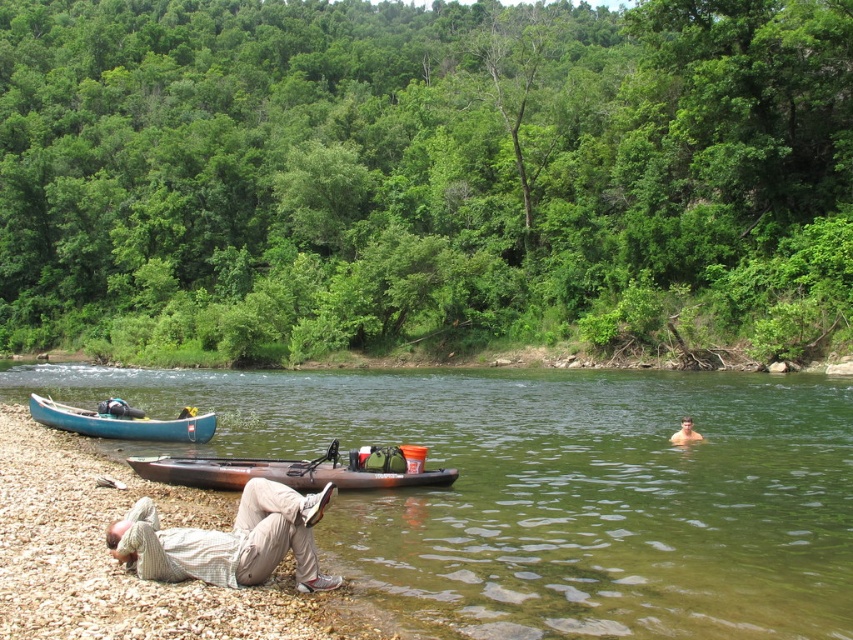
You are a hiker who just arrived at the riverside and see the smooth pebbles at lower left and the light brown cotton pants at lower left. If you want to pick up the pebbles without moving the pants, which direction should you move your hand relative to the pants?

The smooth pebbles at lower left are to the left of the light brown cotton pants at lower left. So, you should move your hand to the left side of the pants to pick up the pebbles without disturbing them.

You are standing at the edge of the river and want to cross to the opposite bank. The green water at center is where the current is calmest. If you aim for the coordinates given by the point, will you reach the middle of the river?

The green water at center is located at point (553, 490), so aiming for those coordinates will direct you to the middle of the river where the current is calmest.

In the scene shown: You are standing at the point closest to the river in this riverside scene. Which of the two points, point (202,408) or point (140,436), is farther away from you?

Point (202,408) is behind point (140,436), so it is farther away from you.